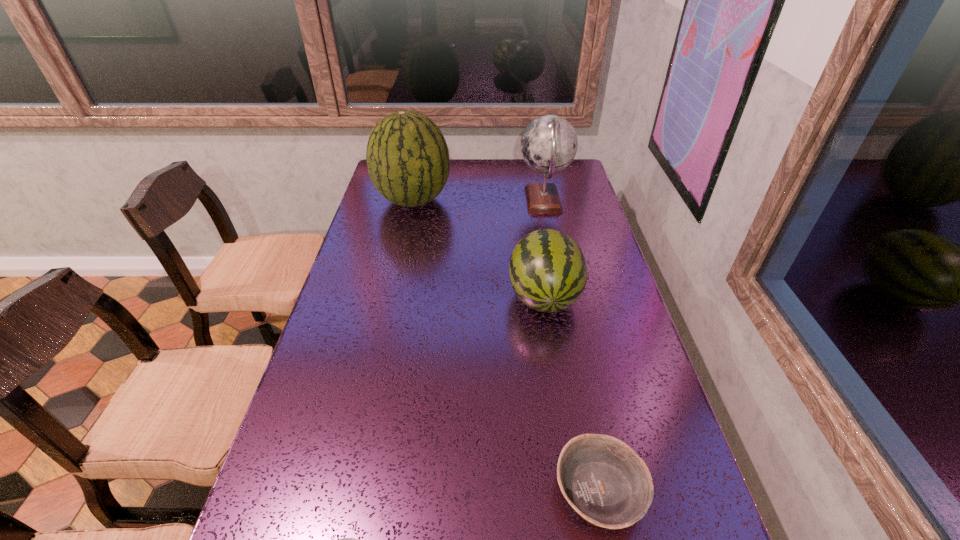
I want to click on globe that is at the far edge, so click(549, 143).

You are a GUI agent. You are given a task and a screenshot of the screen. Output one action in this format:
    pyautogui.click(x=<x>, y=<y>)
    Task: Click on the watermelon that is positioned at the far edge
    The height and width of the screenshot is (540, 960).
    Given the screenshot: What is the action you would take?
    pyautogui.click(x=407, y=156)

What are the coordinates of `object located in the left edge section of the desktop` in the screenshot? It's located at (407, 156).

Identify the location of globe that is positioned at the right edge. Image resolution: width=960 pixels, height=540 pixels. (549, 143).

I want to click on watermelon that is at the right edge, so click(548, 272).

I want to click on object that is at the far left corner, so click(x=407, y=156).

This screenshot has width=960, height=540. In order to click on object at the far right corner in this screenshot , I will do `click(549, 143)`.

This screenshot has height=540, width=960. I want to click on vacant space at the far edge, so click(x=464, y=176).

In order to click on free space at the right edge of the desktop in this screenshot , I will do `click(607, 384)`.

Locate an element on the screen. free space that is in between the globe and the taller watermelon is located at coordinates (478, 200).